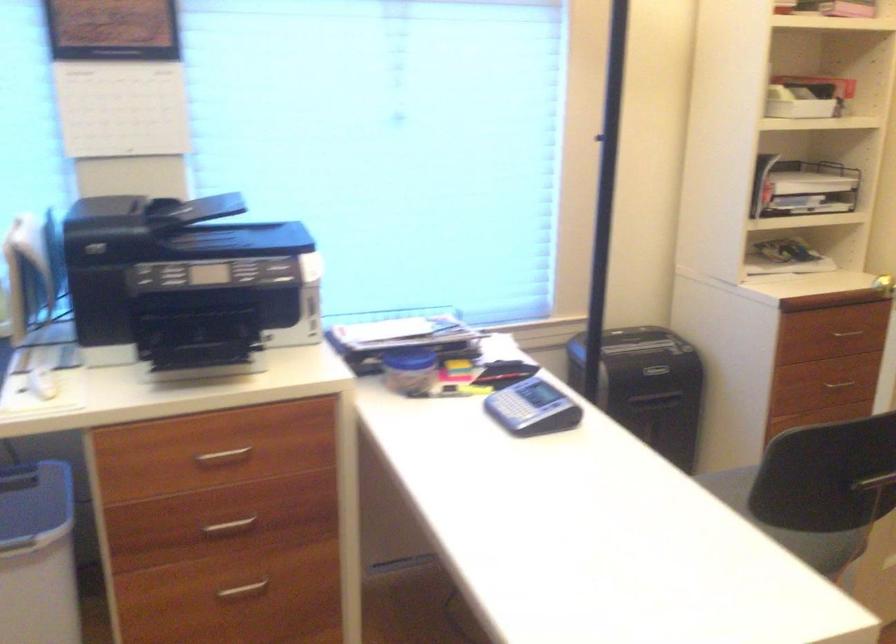
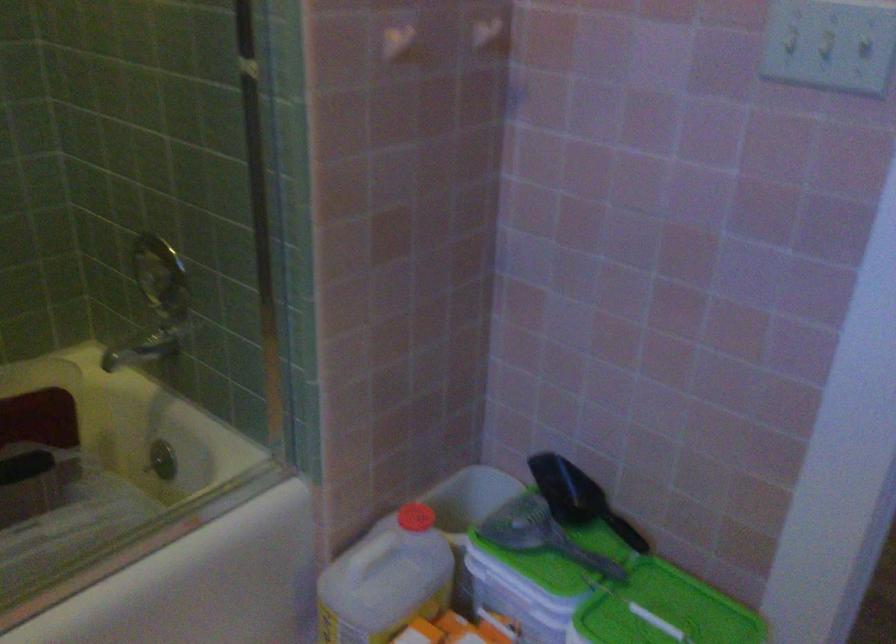
Question: I am providing you with two images of the same scene from different viewpoints. Which of the following objects are not visible in image2?

Choices:
 (A) pink piggy bank
 (B) drawer handle
 (C) shower faucet handle
 (D) red bottle cap

Answer: (B)